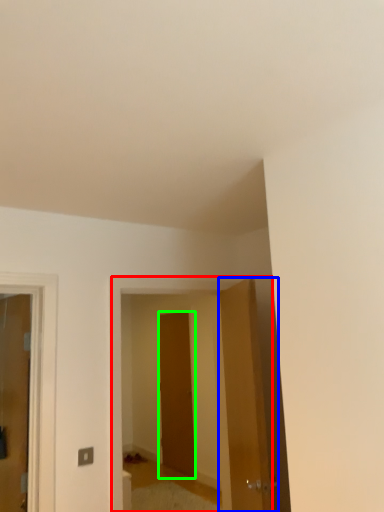
Question: Based on their relative distances, which object is nearer to elevator (highlighted by a red box)? Choose from door (highlighted by a blue box) and door (highlighted by a green box).

Choices:
 (A) door
 (B) door

Answer: (A)